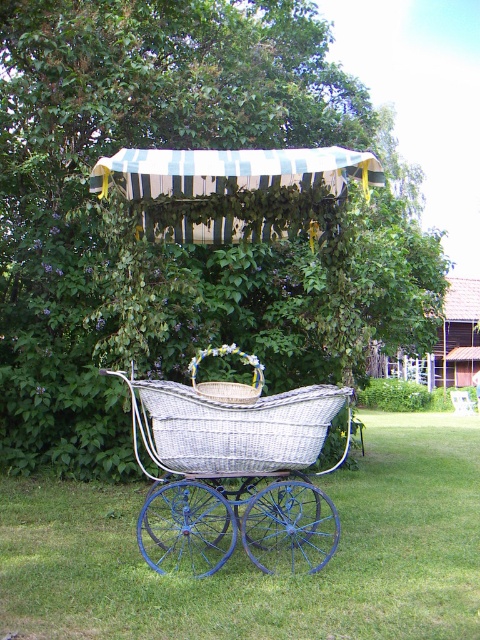
Does green leafy tree at center appear on the right side of green striped fabric canopy at upper center?

Yes, green leafy tree at center is to the right of green striped fabric canopy at upper center.

Identify the location of green leafy tree at center. (170, 244).

This screenshot has width=480, height=640. Find the location of `green leafy tree at center`. green leafy tree at center is located at coordinates [170, 244].

Who is shorter, green leafy tree at center or woven wicker baby carriage at center?

woven wicker baby carriage at center is shorter.

Between green leafy tree at center and woven wicker baby carriage at center, which one appears on the right side from the viewer's perspective?

Positioned to the right is green leafy tree at center.

Image resolution: width=480 pixels, height=640 pixels. I want to click on green leafy tree at center, so 170,244.

Is green leafy tree at center thinner than white wicker carriage at center?

Yes.

Can you confirm if green leafy tree at center is taller than white wicker carriage at center?

Yes, green leafy tree at center is taller than white wicker carriage at center.

The width and height of the screenshot is (480, 640). Describe the element at coordinates (170, 244) in the screenshot. I see `green leafy tree at center` at that location.

This screenshot has width=480, height=640. Find the location of `green leafy tree at center`. green leafy tree at center is located at coordinates (170, 244).